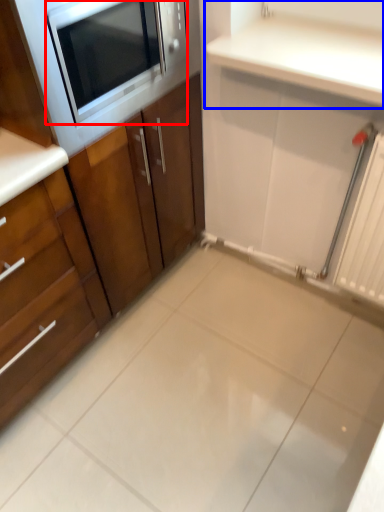
Question: Which object appears closest to the camera in this image, microwave oven (highlighted by a red box) or countertop (highlighted by a blue box)?

Choices:
 (A) microwave oven
 (B) countertop

Answer: (A)